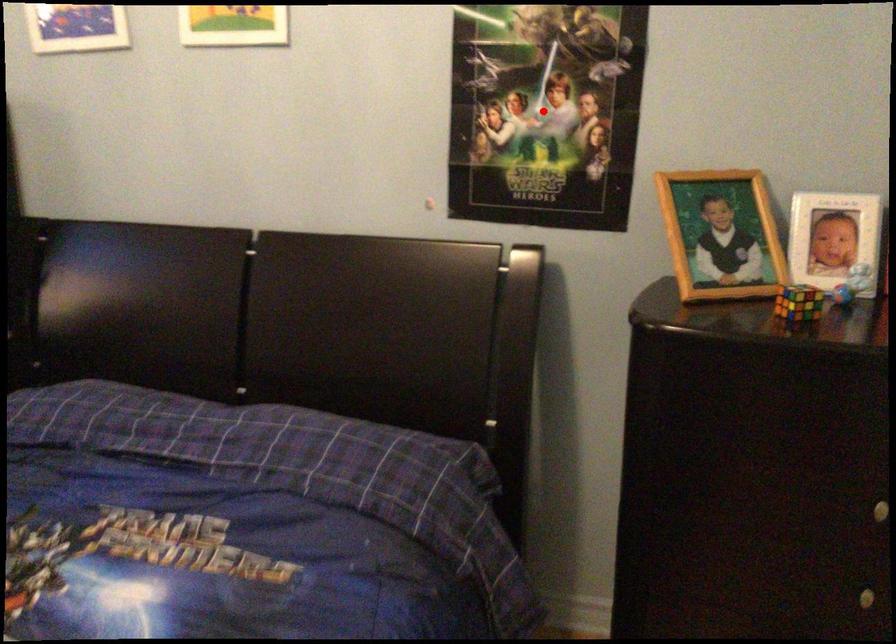
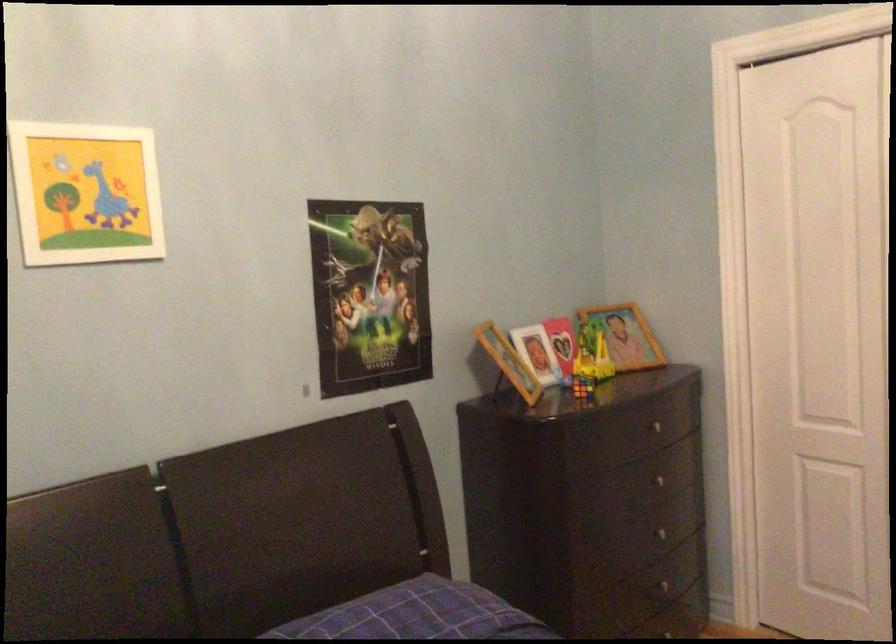
Find the pixel in the second image that matches the highlighted location in the first image.

(369, 294)